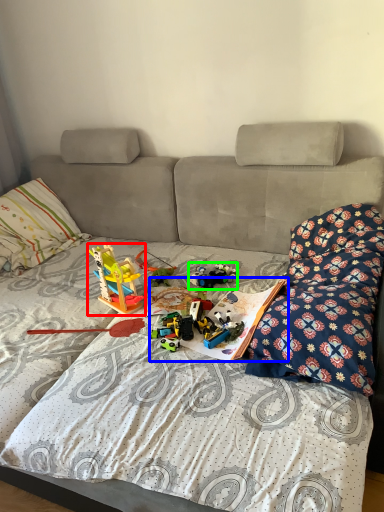
Question: Which object is the closest to the toy (highlighted by a red box)? Choose among these: book (highlighted by a blue box) or toy (highlighted by a green box).

Choices:
 (A) book
 (B) toy

Answer: (B)